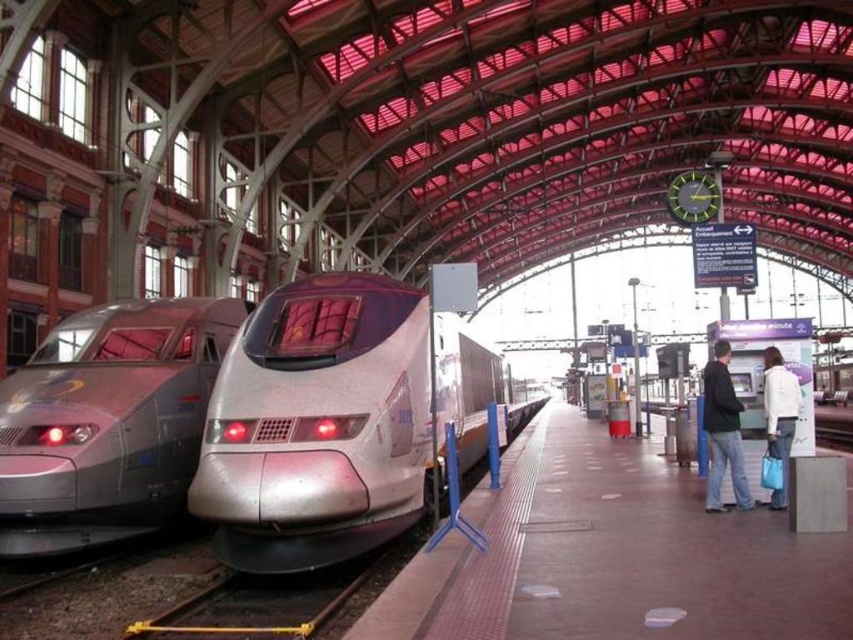
You are a passenger waiting on the platform and see the sleek silver train at left and the white fabric jacket at right. Which object is larger in size?

The sleek silver train at left is bigger than the white fabric jacket at right.

You are standing on the platform of the train station. You see a point marked at coordinate (331,422). What object is located at that point?

The point at coordinate (331,422) corresponds to the sleek silver train at center.

From the picture: You are a passenger waiting on the platform and need to board the train. You see the sleek silver train at left and the dark blue jeans at right. Which one is taller?

The sleek silver train at left is taller than the dark blue jeans at right.